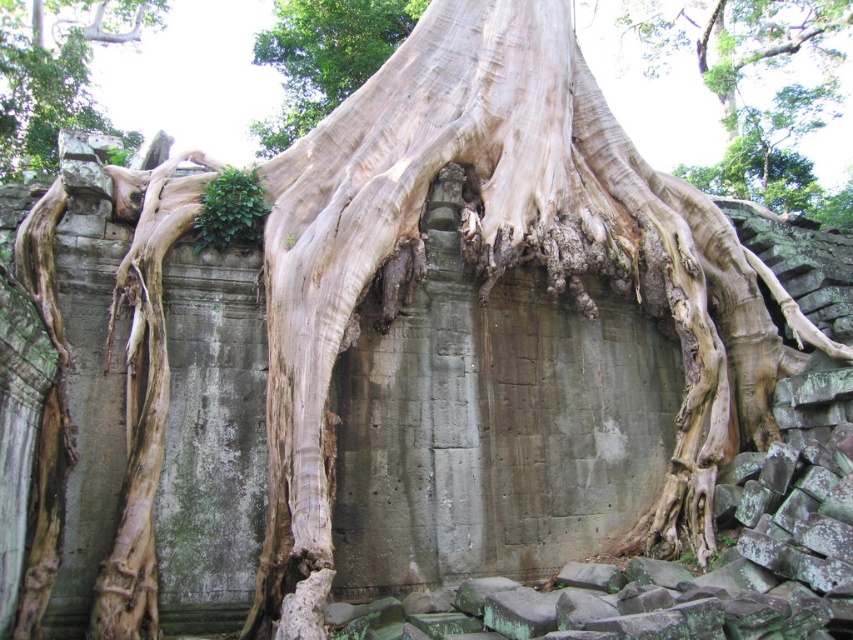
Who is positioned more to the left, smooth bark tree trunk at upper left or smooth bark tree trunk at center?

smooth bark tree trunk at upper left

Can you confirm if smooth bark tree trunk at upper left is positioned below smooth bark tree trunk at center?

Yes.

Does point (132, 4) lie in front of point (289, 106)?

No, it is behind (289, 106).

Locate an element on the screen. This screenshot has height=640, width=853. smooth bark tree trunk at upper left is located at coordinates (55, 72).